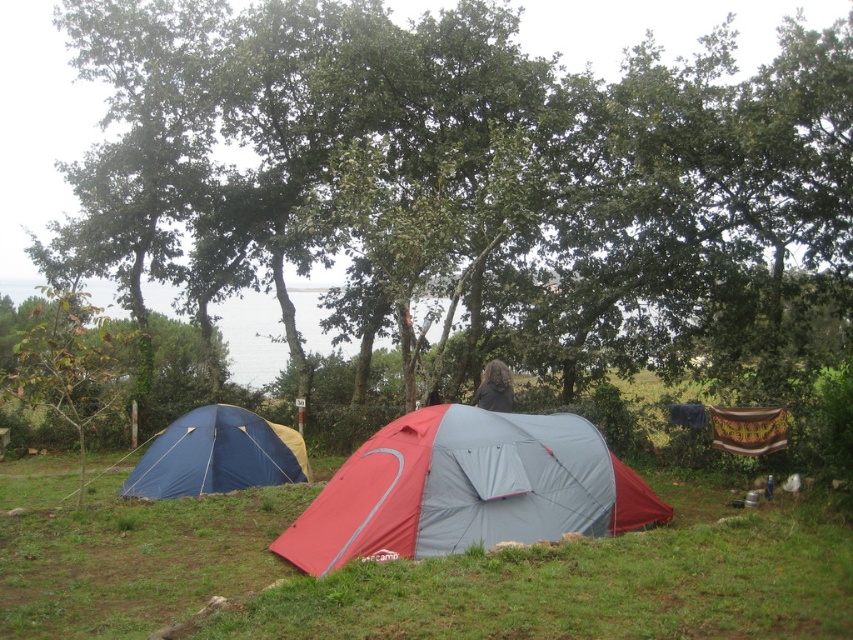
Question: Is red fabric tent at center positioned in front of blue tarpaulin tent at lower left?

Choices:
 (A) no
 (B) yes

Answer: (B)

Question: From the image, what is the correct spatial relationship of red/gray fabric tent at center in relation to blue tarpaulin tent at lower left?

Choices:
 (A) below
 (B) above

Answer: (B)

Question: Which of the following is the farthest from the observer?

Choices:
 (A) (556, 538)
 (B) (131, 502)
 (C) (283, 483)

Answer: (C)

Question: Is green leafy tree at center closer to the viewer compared to blue tarpaulin tent at lower left?

Choices:
 (A) yes
 (B) no

Answer: (A)

Question: Which of these objects is positioned closest to the red fabric tent at center?

Choices:
 (A) green leafy tree at center
 (B) blue tarpaulin tent at lower left
 (C) dark brown hair at center

Answer: (B)

Question: Which object appears farthest from the camera in this image?

Choices:
 (A) green leafy tree at center
 (B) red fabric tent at center

Answer: (A)